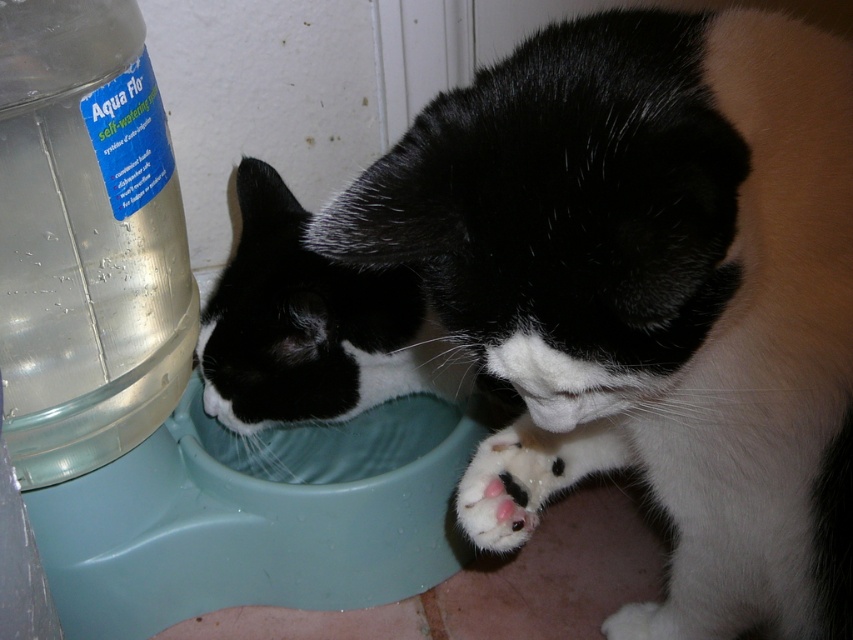
Is transparent plastic bottle at left closer to camera compared to white fur paw at lower center?

Yes, it is in front of white fur paw at lower center.

Who is shorter, transparent plastic bottle at left or white fur paw at lower center?

Standing shorter between the two is white fur paw at lower center.

This screenshot has height=640, width=853. In order to click on transparent plastic bottle at left in this screenshot , I will do `click(86, 240)`.